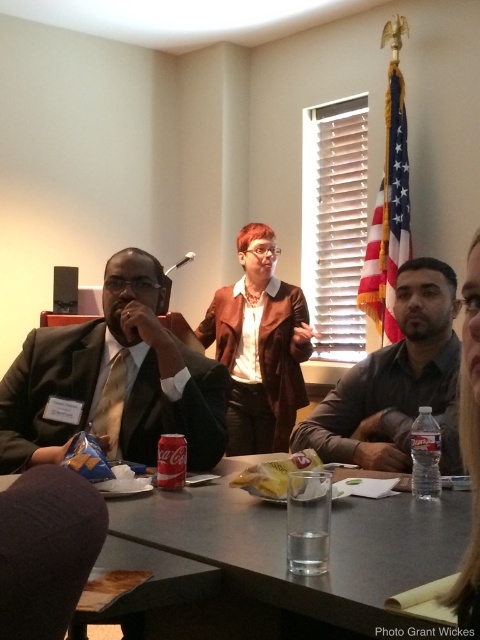
Question: Can you confirm if smooth gray table at center is smaller than matte black shirt at center?

Choices:
 (A) yes
 (B) no

Answer: (A)

Question: Considering the relative positions of smooth gray table at center and silver metallic microphone at upper center in the image provided, where is smooth gray table at center located with respect to silver metallic microphone at upper center?

Choices:
 (A) right
 (B) left

Answer: (A)

Question: Observing the image, what is the correct spatial positioning of brown leather jacket at center in reference to matte black laptop at left?

Choices:
 (A) below
 (B) above

Answer: (A)

Question: Which object appears farthest from the camera in this image?

Choices:
 (A) matte black laptop at left
 (B) smooth gray table at center
 (C) matte black suit at left
 (D) brown leather jacket at center

Answer: (A)

Question: Among these objects, which one is nearest to the camera?

Choices:
 (A) dark gray fabric at lower left
 (B) matte black laptop at left

Answer: (A)

Question: Based on their relative distances, which object is farther from the matte black laptop at left?

Choices:
 (A) matte black shirt at center
 (B) matte black suit at left
 (C) smooth gray table at center

Answer: (C)